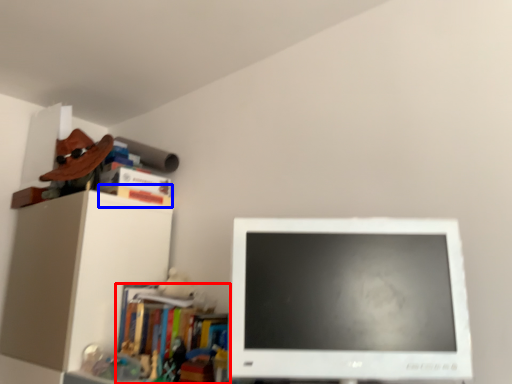
Question: Which of the following is the farthest to the observer, book (highlighted by a red box) or book (highlighted by a blue box)?

Choices:
 (A) book
 (B) book

Answer: (B)